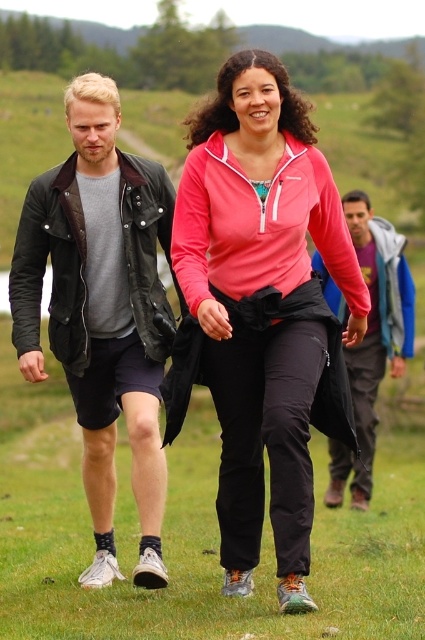
Which is above, suede leather jacket at left or blue denim jacket at center?

Positioned higher is suede leather jacket at left.

Between point (156, 307) and point (367, 492), which one is positioned behind?

The point (367, 492) is behind.

Where is `suede leather jacket at left`? The height and width of the screenshot is (640, 425). suede leather jacket at left is located at coordinates (102, 310).

Which is more to the right, pink fleece jacket at center or suede leather jacket at left?

pink fleece jacket at center

Does pink fleece jacket at center have a greater width compared to suede leather jacket at left?

Correct, the width of pink fleece jacket at center exceeds that of suede leather jacket at left.

At what (x,y) coordinates should I click in order to perform the action: click on pink fleece jacket at center. Please return your answer as a coordinate pair (x, y). The height and width of the screenshot is (640, 425). Looking at the image, I should click on (266, 308).

Which is in front, point (263, 225) or point (376, 276)?

Point (263, 225)

The width and height of the screenshot is (425, 640). What do you see at coordinates (266, 308) in the screenshot? I see `pink fleece jacket at center` at bounding box center [266, 308].

At what (x,y) coordinates should I click in order to perform the action: click on pink fleece jacket at center. Please return your answer as a coordinate pair (x, y). Looking at the image, I should click on (266, 308).